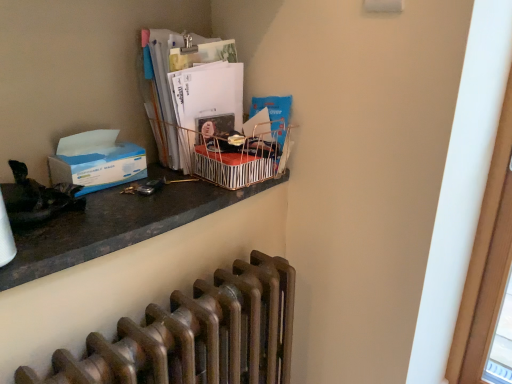
You are a GUI agent. You are given a task and a screenshot of the screen. Output one action in this format:
    pyautogui.click(x=<x>, y=<y>)
    Task: Click on the vacant space situated above matte black desk at upper left (from a real-world perspective)
    The width and height of the screenshot is (512, 384).
    Given the screenshot: What is the action you would take?
    pyautogui.click(x=137, y=192)